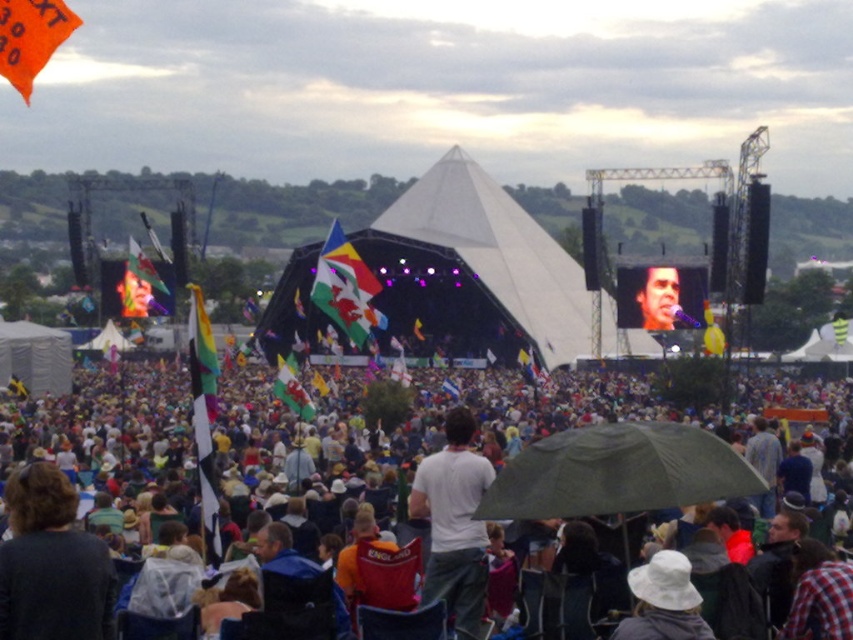
Question: Among these points, which one is farthest from the camera?

Choices:
 (A) (676, 269)
 (B) (433, 477)

Answer: (A)

Question: Does white fabric crowd at center have a larger size compared to green matte umbrella at center?

Choices:
 (A) yes
 (B) no

Answer: (A)

Question: Is white fabric crowd at center closer to the viewer compared to white cotton shirt at center?

Choices:
 (A) no
 (B) yes

Answer: (B)

Question: Can you confirm if white fabric crowd at center is positioned above white cotton shirt at center?

Choices:
 (A) no
 (B) yes

Answer: (B)

Question: Among these objects, which one is farthest from the camera?

Choices:
 (A) white cotton shirt at center
 (B) white fabric crowd at center

Answer: (A)

Question: Which object is positioned farthest from the green matte umbrella at center?

Choices:
 (A) white cotton shirt at center
 (B) smooth skin face at center

Answer: (B)